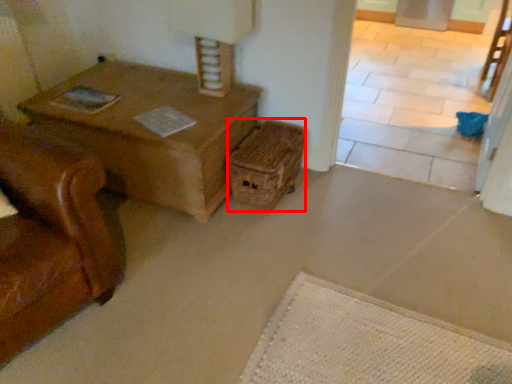
Question: From the image's perspective, considering the relative positions of crate (annotated by the red box) and chair in the image provided, where is crate (annotated by the red box) located with respect to the staircase?

Choices:
 (A) above
 (B) below

Answer: (B)